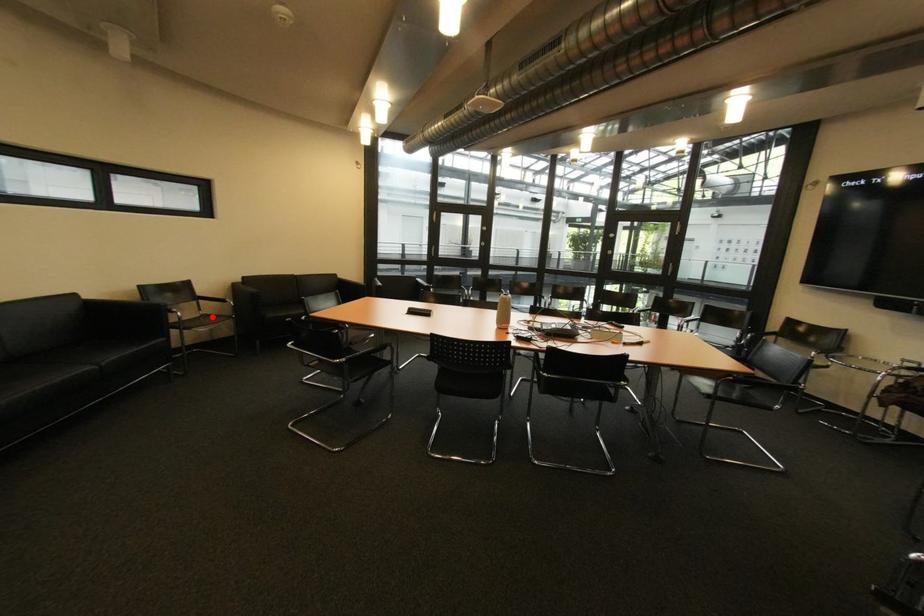
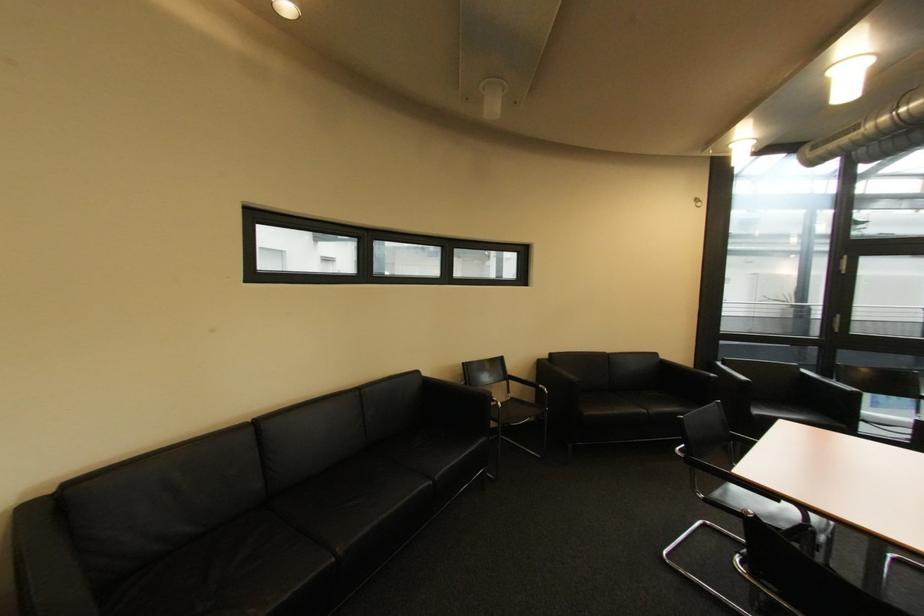
Find the pixel in the second image that matches the highlighted location in the first image.

(520, 400)